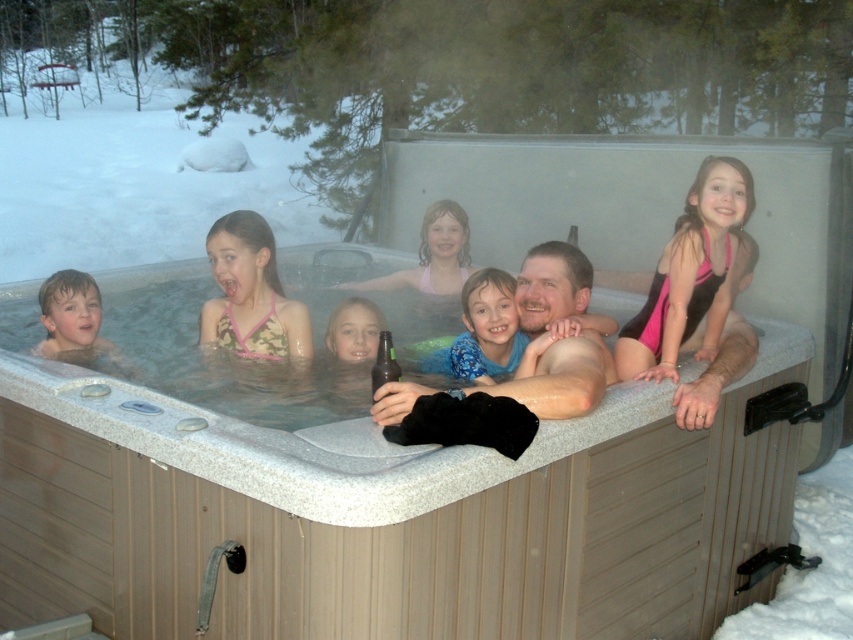
Question: Is beige plastic hot tub at center closer to the viewer compared to pink fabric swimsuit at center?

Choices:
 (A) no
 (B) yes

Answer: (B)

Question: Which of the following is the farthest from the observer?

Choices:
 (A) (366, 435)
 (B) (531, 276)

Answer: (B)

Question: Among these points, which one is nearest to the camera?

Choices:
 (A) (572, 276)
 (B) (619, 372)
 (C) (456, 348)

Answer: (B)

Question: Which object is the farthest from the smooth skin man at center?

Choices:
 (A) smooth skin boy at left
 (B) beige plastic hot tub at center
 (C) smooth skin face at center
 (D) pink swimsuit at upper right

Answer: (A)

Question: Does pink swimsuit at upper right have a greater width compared to smooth skin man at center?

Choices:
 (A) yes
 (B) no

Answer: (B)

Question: Where is smooth skin man at center located in relation to camouflage swimsuit at center in the image?

Choices:
 (A) above
 (B) below

Answer: (B)